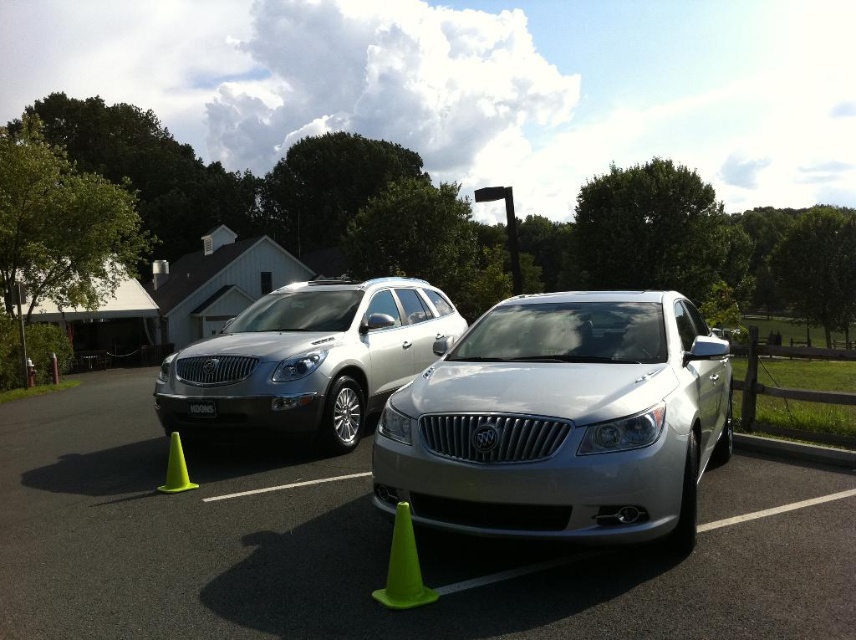
At what (x,y) coordinates should I click in order to perform the action: click on satin silver suv at center. Please return your answer as a coordinate pair (x, y). Image resolution: width=856 pixels, height=640 pixels. Looking at the image, I should click on (307, 358).

Is the position of satin silver suv at center more distant than that of black plastic license plate at center?

→ No, satin silver suv at center is in front of black plastic license plate at center.

The width and height of the screenshot is (856, 640). Identify the location of satin silver suv at center. (307, 358).

Between satin silver sedan at center and satin silver suv at center, which one appears on the left side from the viewer's perspective?

satin silver suv at center

Is satin silver sedan at center wider than satin silver suv at center?

No, satin silver sedan at center is not wider than satin silver suv at center.

Is point (617, 492) farther from viewer compared to point (397, 349)?

That is False.

Identify the location of satin silver sedan at center. (562, 420).

Can you confirm if satin silver car at center is shorter than satin silver sedan at center?

Correct, satin silver car at center is not as tall as satin silver sedan at center.

Find the location of `satin silver car at center`. satin silver car at center is located at coordinates (372, 547).

You are a GUI agent. You are given a task and a screenshot of the screen. Output one action in this format:
    pyautogui.click(x=<x>, y=<y>)
    Task: Click on the satin silver car at center
    The width and height of the screenshot is (856, 640).
    Given the screenshot: What is the action you would take?
    pyautogui.click(x=372, y=547)

You are a GUI agent. You are given a task and a screenshot of the screen. Output one action in this format:
    pyautogui.click(x=<x>, y=<y>)
    Task: Click on the satin silver car at center
    The width and height of the screenshot is (856, 640).
    Given the screenshot: What is the action you would take?
    pyautogui.click(x=372, y=547)